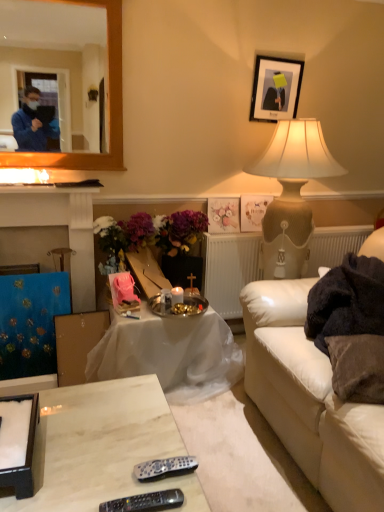
You are a GUI agent. You are given a task and a screenshot of the screen. Output one action in this format:
    pyautogui.click(x=<x>, y=<y>)
    Task: Click on the vacant space that's between black plastic remote at lower center, which is the 2th remote in back-to-front order, and silver metallic remote at lower center, the 1th remote viewed from the back
    
    Given the screenshot: What is the action you would take?
    pyautogui.click(x=142, y=492)